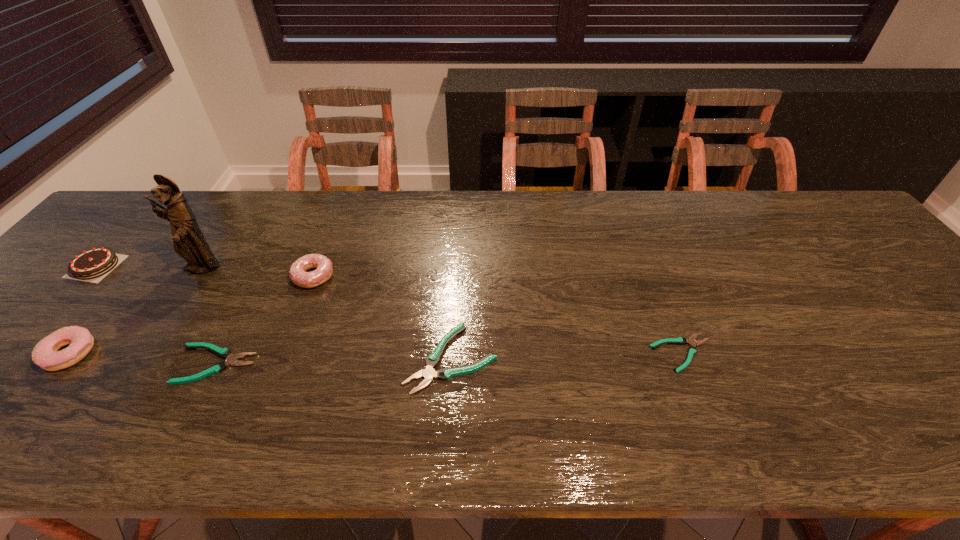
You are a GUI agent. You are given a task and a screenshot of the screen. Output one action in this format:
    pyautogui.click(x=<x>, y=<y>)
    Task: Click on the chocolate cake located in the left edge section of the desktop
    
    Given the screenshot: What is the action you would take?
    pyautogui.click(x=96, y=262)

Identify the location of doughnut at the left edge. The image size is (960, 540). (45, 354).

I want to click on object present at the near left corner, so click(x=45, y=354).

Find the location of a particular element. The width and height of the screenshot is (960, 540). free space at the far edge of the desktop is located at coordinates (440, 211).

Find the location of a particular element. The width and height of the screenshot is (960, 540). vacant space at the near edge of the desktop is located at coordinates (121, 404).

Identify the location of free region at the far left corner of the desktop. (111, 230).

Image resolution: width=960 pixels, height=540 pixels. What are the coordinates of `blank region between the farther doughnut and the leftmost pliers` in the screenshot? It's located at (265, 320).

Identify the location of vacant space in between the chocolate cake and the second object from right to left. (274, 313).

At what (x,y) coordinates should I click in order to perform the action: click on blank region between the second tallest pliers and the chocolate cake. Please return your answer as a coordinate pair (x, y). Looking at the image, I should click on (156, 315).

Where is `free space between the second shortest pliers and the fifth tallest object`? free space between the second shortest pliers and the fifth tallest object is located at coordinates (x=334, y=361).